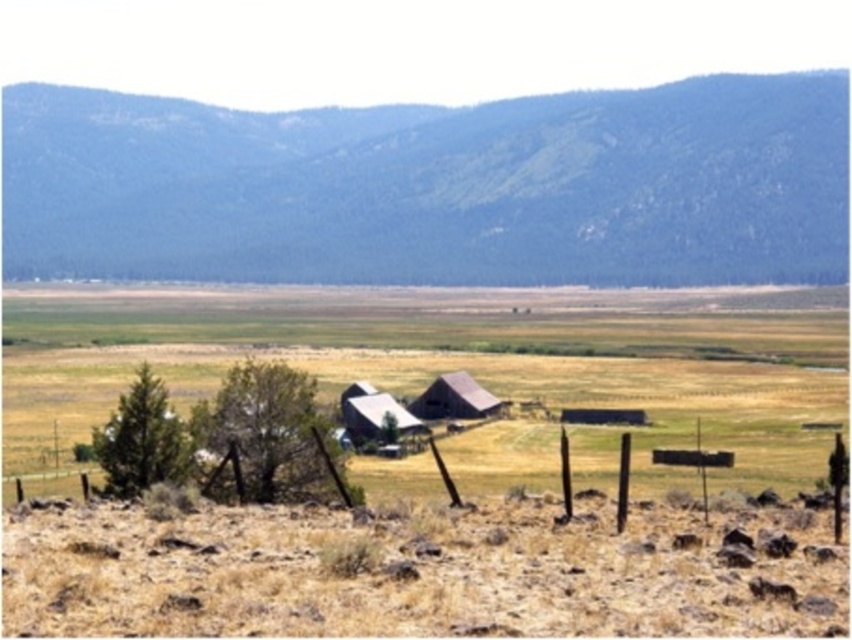
Question: Based on their relative distances, which object is farther from the brown wooden fence at lower center?

Choices:
 (A) green textured mountain at upper center
 (B) brown canvas tent at center
 (C) wooden barn at center

Answer: (A)

Question: Does green textured mountain at upper center appear on the left side of brown canvas tent at center?

Choices:
 (A) no
 (B) yes

Answer: (B)

Question: Observing the image, what is the correct spatial positioning of green textured mountain at upper center in reference to wooden barn at center?

Choices:
 (A) left
 (B) right

Answer: (A)

Question: Which object is closer to the camera taking this photo?

Choices:
 (A) brown wooden fence at lower center
 (B) brown canvas tent at center
 (C) green textured mountain at upper center

Answer: (A)

Question: Is green textured mountain at upper center wider than wooden barn at center?

Choices:
 (A) yes
 (B) no

Answer: (A)

Question: Which of the following is the closest to the observer?

Choices:
 (A) (822, 435)
 (B) (412, 173)

Answer: (A)